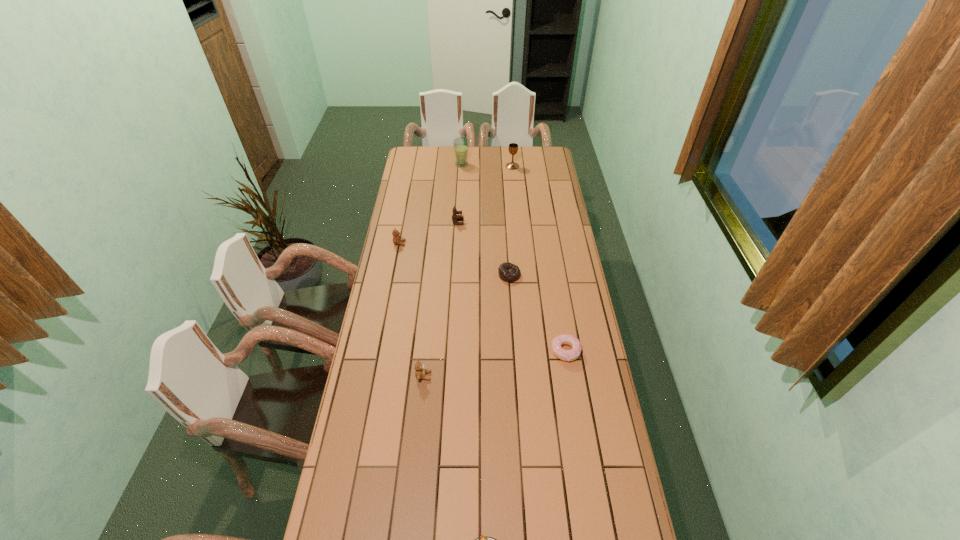
Where is `vacant point located between the chalice and the fourth nearest object`? This screenshot has height=540, width=960. vacant point located between the chalice and the fourth nearest object is located at coordinates (511, 220).

Where is `vacant space that is in between the second teddy bear from right to left and the beanbag`? vacant space that is in between the second teddy bear from right to left and the beanbag is located at coordinates (467, 325).

I want to click on free space between the nearest teddy bear and the chalice, so click(x=468, y=271).

At what (x,y) coordinates should I click in order to perform the action: click on vacant space in between the second teddy bear from left to right and the third nearest object. Please return your answer as a coordinate pair (x, y). Looking at the image, I should click on (494, 363).

The height and width of the screenshot is (540, 960). Identify the location of unoccupied area between the leftmost object and the second teddy bear from right to left. (412, 309).

This screenshot has height=540, width=960. I want to click on object that is the fourth closest to the glass, so click(508, 272).

Identify which object is the third closest to the farthest teddy bear. Please provide its 2D coordinates. Your answer should be formatted as a tuple, i.e. [(x, y)], where the tuple contains the x and y coordinates of a point satisfying the conditions above.

[(461, 144)]

Select which teddy bear appears as the second closest to the glass. Please provide its 2D coordinates. Your answer should be formatted as a tuple, i.e. [(x, y)], where the tuple contains the x and y coordinates of a point satisfying the conditions above.

[(397, 240)]

You are a GUI agent. You are given a task and a screenshot of the screen. Output one action in this format:
    pyautogui.click(x=<x>, y=<y>)
    Task: Click on the second closest teddy bear relative to the chalice
    Image resolution: width=960 pixels, height=540 pixels.
    Given the screenshot: What is the action you would take?
    pyautogui.click(x=397, y=240)

At what (x,y) coordinates should I click in order to perform the action: click on vacant point that satisfies the following two spatial constraints: 1. on the back side of the fifth farthest object; 2. on the face of the second nearest teddy bear. Please return your answer as a coordinate pair (x, y). The width and height of the screenshot is (960, 540). Looking at the image, I should click on (507, 243).